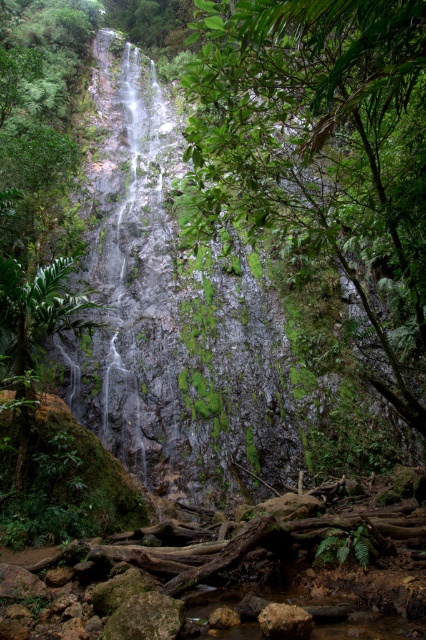
Based on the photo, you are a hiker navigating through the waterfall area. You need to place a small weatherproof box between the green mossy rock at center and the rusty metallic rock at lower center. According to their positions, which rock should the box be closer to?

The box should be placed closer to the rusty metallic rock at lower center because the green mossy rock at center is located to the right of the rusty metallic rock at lower center, meaning the rusty metallic rock is positioned further to the left, so the box should be placed between them with closer proximity to the left side where the rusty metallic rock is situated.

You are a hiker carrying a backpack with a 36.94 inch long tool that needs to be placed between the green mossy rock at lower center and the rusty metallic rock at lower center. Can the tool fit exactly between them?

The green mossy rock at lower center and rusty metallic rock at lower center are 36.94 inches apart from each other, so the tool can fit exactly between them as the distance matches the tool length.

You are a hiker who wants to cross the stream below the waterfall. There are two green mossy rocks in the stream. The first is at the center, and the second is at the lower center. If you can jump 6 meters, will you be able to jump from the green mossy rock at center to the green mossy rock at lower center?

The green mossy rock at center and green mossy rock at lower center are 6.55 meters apart from each other. Since your jump distance is 6 meters, you cannot make the jump between them as the distance exceeds your capability.